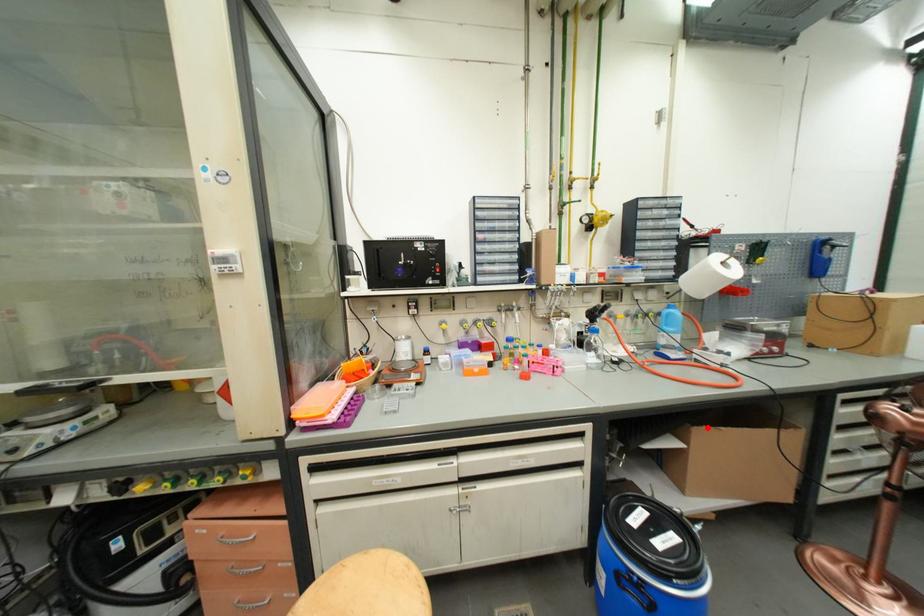
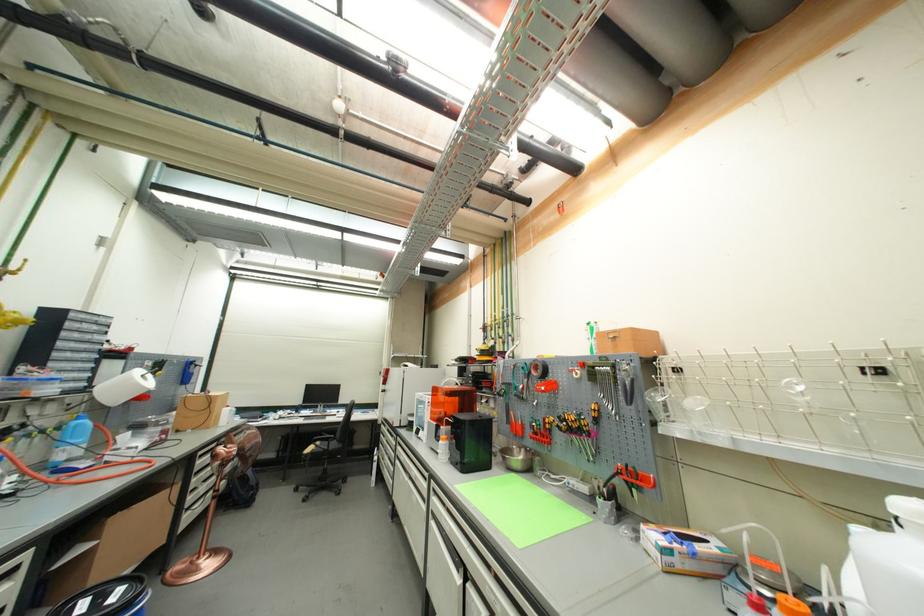
The point at the highlighted location is marked in the first image. Where is the corresponding point in the second image?

(123, 515)